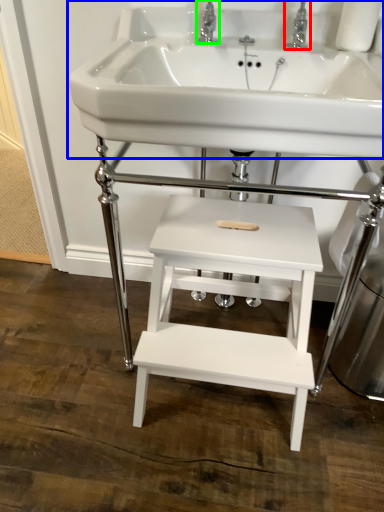
Question: Considering the real-world distances, which object is closest to tap (highlighted by a red box)? sink (highlighted by a blue box) or tap (highlighted by a green box).

Choices:
 (A) sink
 (B) tap

Answer: (B)